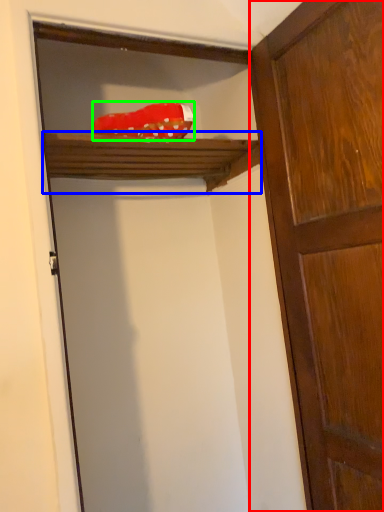
Question: Estimate the real-world distances between objects in this image. Which object is farther from door (highlighted by a red box), shelf (highlighted by a blue box) or material (highlighted by a green box)?

Choices:
 (A) shelf
 (B) material

Answer: (B)